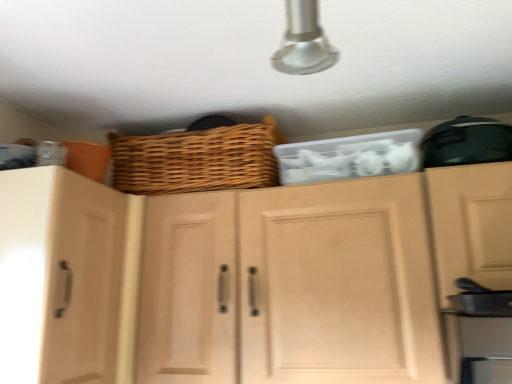
Question: Does wooden cabinet doors at center, placed as the 2th cabinetry when sorted from left to right, have a smaller size compared to woven brown basket at upper center?

Choices:
 (A) no
 (B) yes

Answer: (A)

Question: Does wooden cabinet doors at center, which ranks as the 1th cabinetry in right-to-left order, have a greater width compared to woven brown basket at upper center?

Choices:
 (A) no
 (B) yes

Answer: (B)

Question: From a real-world perspective, is wooden cabinet doors at center, which ranks as the 1th cabinetry in right-to-left order, physically below woven brown basket at upper center?

Choices:
 (A) no
 (B) yes

Answer: (B)

Question: Is wooden cabinet doors at center, placed as the 2th cabinetry when sorted from left to right, thinner than woven brown basket at upper center?

Choices:
 (A) no
 (B) yes

Answer: (A)

Question: Is wooden cabinet doors at center, which ranks as the 1th cabinetry in right-to-left order, behind woven brown basket at upper center?

Choices:
 (A) no
 (B) yes

Answer: (A)

Question: From the image's perspective, is woven brown basket at upper center positioned above or below wooden cabinet doors at center, placed as the 2th cabinetry when sorted from left to right?

Choices:
 (A) above
 (B) below

Answer: (A)

Question: Considering the positions of woven brown basket at upper center and wooden cabinet doors at center, placed as the 2th cabinetry when sorted from left to right, in the image, is woven brown basket at upper center wider or thinner than wooden cabinet doors at center, placed as the 2th cabinetry when sorted from left to right,?

Choices:
 (A) wide
 (B) thin

Answer: (B)

Question: Looking at the image, does woven brown basket at upper center seem bigger or smaller compared to wooden cabinet doors at center, placed as the 2th cabinetry when sorted from left to right?

Choices:
 (A) big
 (B) small

Answer: (B)

Question: Is woven brown basket at upper center to the left or to the right of wooden cabinet doors at center, placed as the 2th cabinetry when sorted from left to right, in the image?

Choices:
 (A) left
 (B) right

Answer: (A)

Question: Considering the positions of woven brown basket at upper center and light wood cabinet at left, which is counted as the first cabinetry, starting from the left, in the image, is woven brown basket at upper center wider or thinner than light wood cabinet at left, which is counted as the first cabinetry, starting from the left,?

Choices:
 (A) thin
 (B) wide

Answer: (A)

Question: Looking at the image, does woven brown basket at upper center seem bigger or smaller compared to light wood cabinet at left, which is counted as the first cabinetry, starting from the left?

Choices:
 (A) big
 (B) small

Answer: (B)

Question: From a real-world perspective, relative to light wood cabinet at left, which is counted as the first cabinetry, starting from the left, is woven brown basket at upper center vertically above or below?

Choices:
 (A) above
 (B) below

Answer: (A)

Question: From the image's perspective, relative to light wood cabinet at left, arranged as the 2th cabinetry when viewed from the right, is woven brown basket at upper center above or below?

Choices:
 (A) above
 (B) below

Answer: (A)

Question: In the image, is wooden cabinet doors at center, which ranks as the 1th cabinetry in right-to-left order, positioned in front of or behind light wood cabinet at left, which is counted as the first cabinetry, starting from the left?

Choices:
 (A) behind
 (B) front

Answer: (B)

Question: From the image's perspective, is wooden cabinet doors at center, placed as the 2th cabinetry when sorted from left to right, located above or below light wood cabinet at left, arranged as the 2th cabinetry when viewed from the right?

Choices:
 (A) below
 (B) above

Answer: (A)